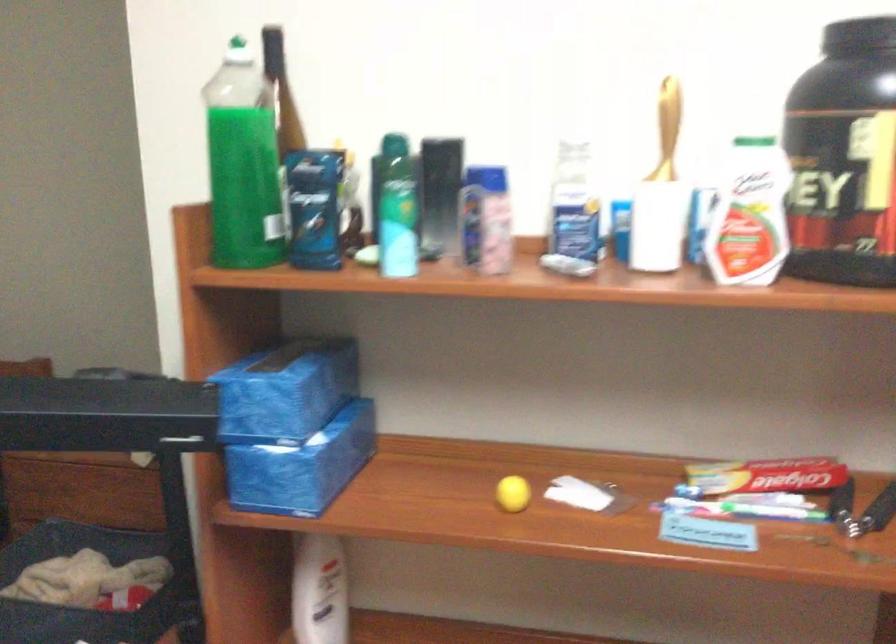
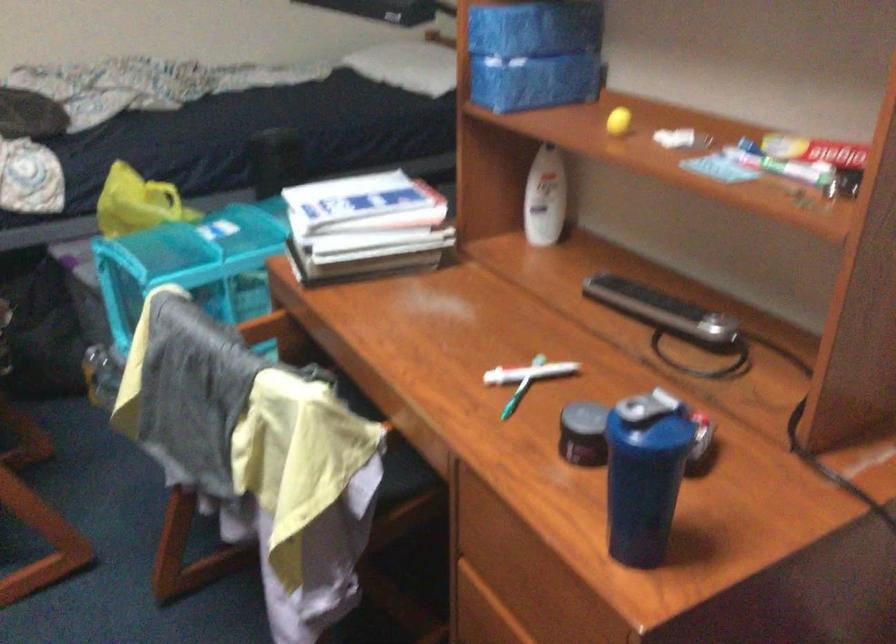
Find the pixel in the second image that matches (334,459) in the first image.

(533, 82)